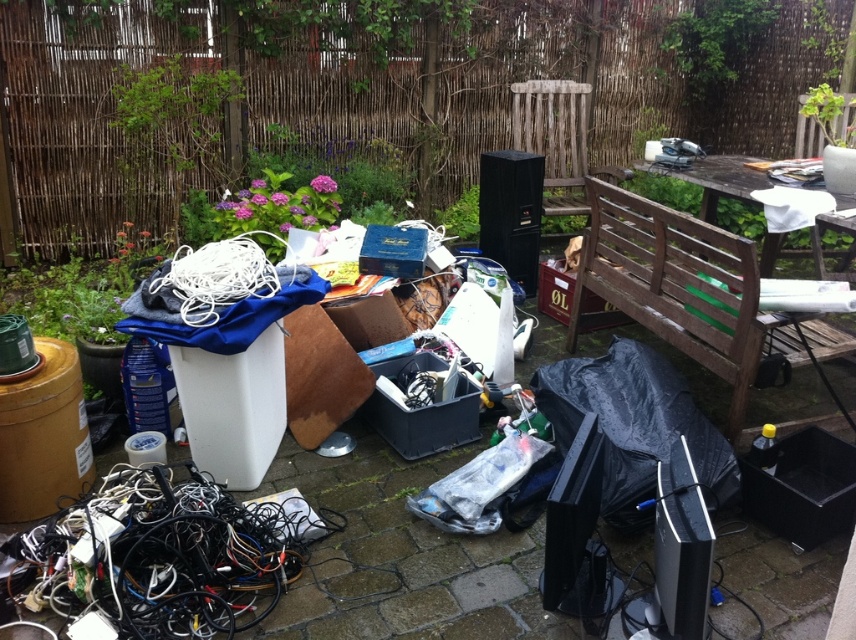
Question: Which point is farther from the camera taking this photo?

Choices:
 (A) (610, 198)
 (B) (167, 604)

Answer: (A)

Question: Can you confirm if black rubber wires at lower left is positioned to the left of brown wooden bench at upper right?

Choices:
 (A) yes
 (B) no

Answer: (A)

Question: Among these points, which one is farthest from the camera?

Choices:
 (A) (696, 346)
 (B) (744, 168)
 (C) (141, 573)

Answer: (B)

Question: Is brown wooden bench at upper right wider than wooden bench at upper right?

Choices:
 (A) no
 (B) yes

Answer: (A)

Question: Which point appears closest to the camera in this image?

Choices:
 (A) (132, 593)
 (B) (705, 326)
 (C) (718, 195)

Answer: (A)

Question: Is brown wooden bench at upper right further to camera compared to wooden bench at upper right?

Choices:
 (A) no
 (B) yes

Answer: (A)